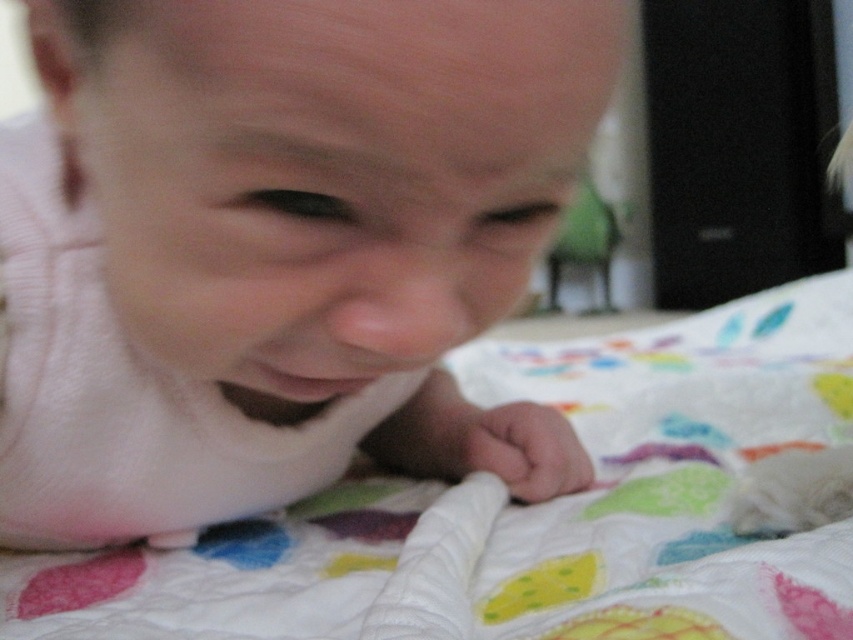
Question: Can you confirm if pink soft fabric baby at center is positioned to the right of white quilt at center?

Choices:
 (A) yes
 (B) no

Answer: (B)

Question: Considering the relative positions of pink soft fabric baby at center and white quilt at center in the image provided, where is pink soft fabric baby at center located with respect to white quilt at center?

Choices:
 (A) right
 (B) left

Answer: (B)

Question: Is pink soft fabric baby at center positioned behind white quilt at center?

Choices:
 (A) yes
 (B) no

Answer: (B)